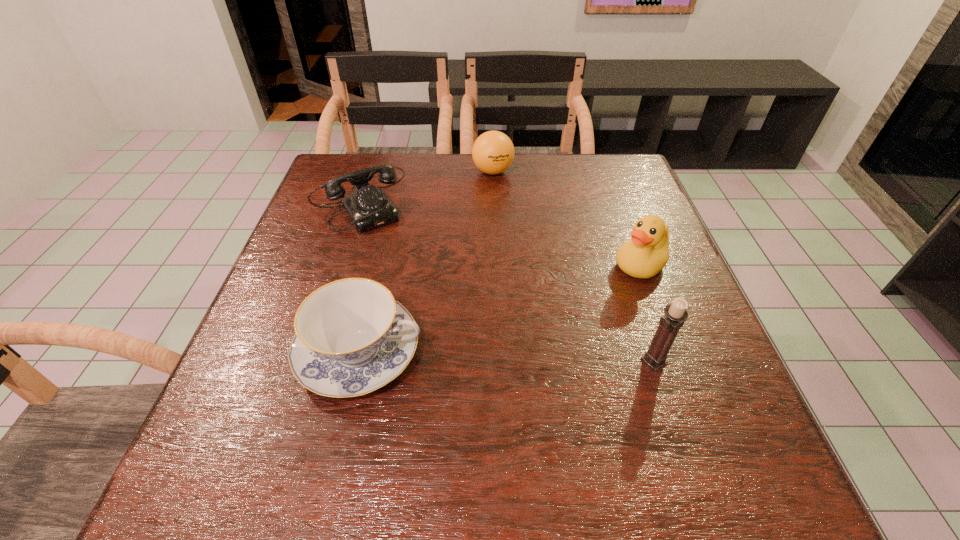
The image size is (960, 540). In order to click on blank area located on the side with brand of the ping-pong ball in this screenshot , I will do `click(489, 218)`.

This screenshot has width=960, height=540. I want to click on blank area located 0.270m on the front-facing side of the telephone, so click(x=420, y=299).

At what (x,y) coordinates should I click in order to perform the action: click on blank space located on the front-facing side of the telephone. Please return your answer as a coordinate pair (x, y). Looking at the image, I should click on (390, 252).

Image resolution: width=960 pixels, height=540 pixels. I want to click on free region located 0.340m on the front-facing side of the telephone, so click(433, 321).

Locate an element on the screen. This screenshot has width=960, height=540. vacant region located at the beak of the duck is located at coordinates (523, 360).

Identify the location of vacant space located 0.210m at the beak of the duck. (563, 329).

The width and height of the screenshot is (960, 540). I want to click on blank space located at the beak of the duck, so click(568, 323).

Locate an element on the screen. ping-pong ball present at the far edge is located at coordinates (493, 152).

The height and width of the screenshot is (540, 960). Identify the location of telephone positioned at the far edge. (368, 207).

The height and width of the screenshot is (540, 960). Identify the location of object located at the near edge. (351, 338).